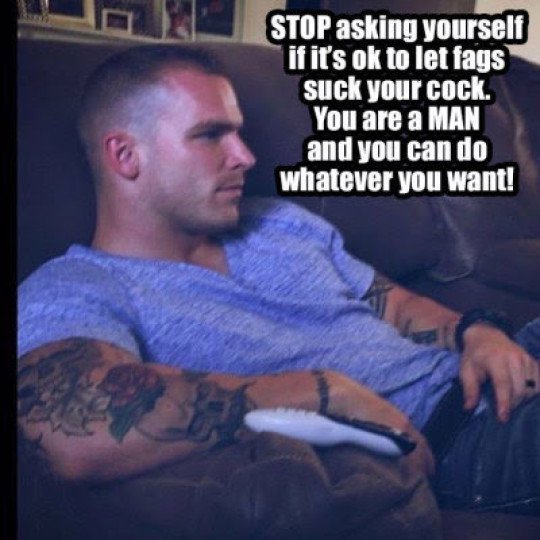
Image resolution: width=540 pixels, height=540 pixels. I want to click on couch armrest, so click(x=247, y=469).